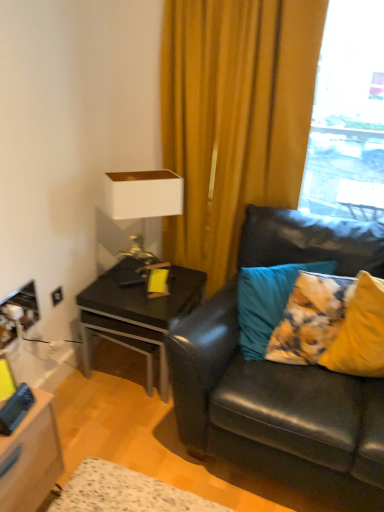
You are a GUI agent. You are given a task and a screenshot of the screen. Output one action in this format:
    pyautogui.click(x=<x>, y=<y>)
    Task: Click on the spots to the right of white matte table lamp at upper left
    This screenshot has width=384, height=512.
    Given the screenshot: What is the action you would take?
    pyautogui.click(x=190, y=282)